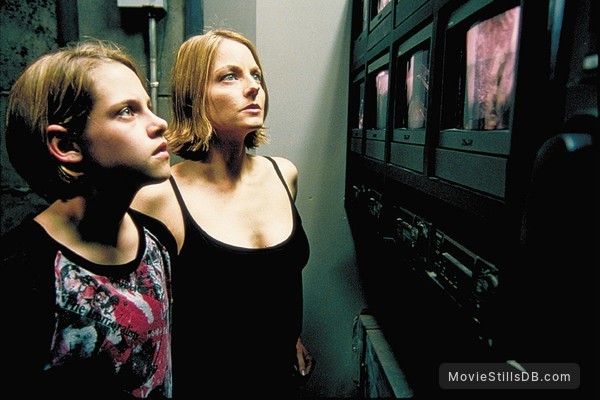
You are a GUI agent. You are given a task and a screenshot of the screen. Output one action in this format:
    pyautogui.click(x=<x>, y=<y>)
    Task: Click on the shadow cast on wall
    Image resolution: width=600 pixels, height=400 pixels.
    Given the screenshot: What is the action you would take?
    pyautogui.click(x=342, y=275)